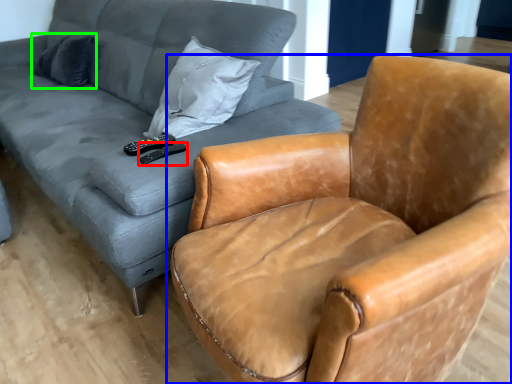
Question: Which object is positioned farthest from remote (highlighted by a red box)? Select from chair (highlighted by a blue box) and pillow (highlighted by a green box).

Choices:
 (A) chair
 (B) pillow

Answer: (B)